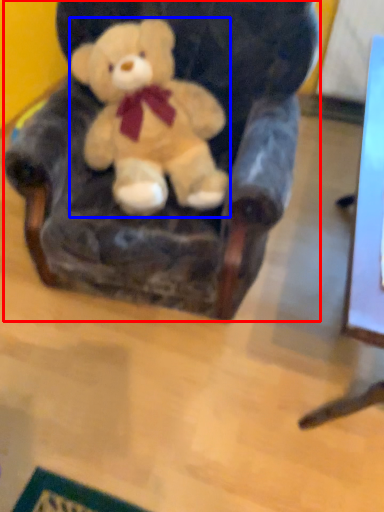
Question: Which object appears closest to the camera in this image, armchair (highlighted by a red box) or teddy bear (highlighted by a blue box)?

Choices:
 (A) armchair
 (B) teddy bear

Answer: (A)